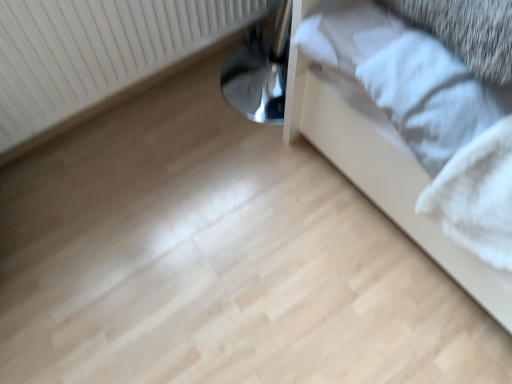
Measure the distance between white textured radiator at upper left and camera.

The depth of white textured radiator at upper left is 36.69 inches.

What do you see at coordinates (97, 55) in the screenshot?
I see `white textured radiator at upper left` at bounding box center [97, 55].

At what (x,y) coordinates should I click in order to perform the action: click on white textured radiator at upper left. Please return your answer as a coordinate pair (x, y). Looking at the image, I should click on (97, 55).

What do you see at coordinates (383, 176) in the screenshot?
I see `metallic bed frame at lower right` at bounding box center [383, 176].

What is the approximate width of metallic bed frame at lower right?

The width of metallic bed frame at lower right is 1.02 meters.

The image size is (512, 384). What are the coordinates of `metallic bed frame at lower right` in the screenshot? It's located at (383, 176).

This screenshot has width=512, height=384. I want to click on white textured radiator at upper left, so tap(97, 55).

Consider the image. Does white textured radiator at upper left appear on the left side of metallic bed frame at lower right?

Yes.

Which object is further away from the camera, white textured radiator at upper left or metallic bed frame at lower right?

white textured radiator at upper left is more distant.

Which is behind, point (150, 70) or point (303, 3)?

The point (150, 70) is farther.

From the image's perspective, is white textured radiator at upper left above metallic bed frame at lower right?

Yes.

From a real-world perspective, is white textured radiator at upper left over metallic bed frame at lower right?

No.

Is white textured radiator at upper left wider or thinner than metallic bed frame at lower right?

Considering their sizes, white textured radiator at upper left looks slimmer than metallic bed frame at lower right.

Considering the sizes of white textured radiator at upper left and metallic bed frame at lower right in the image, is white textured radiator at upper left taller or shorter than metallic bed frame at lower right?

Considering their sizes, white textured radiator at upper left has less height than metallic bed frame at lower right.

Does white textured radiator at upper left have a larger size compared to metallic bed frame at lower right?

No.

Is metallic bed frame at lower right a part of white textured radiator at upper left?

No, white textured radiator at upper left does not contain metallic bed frame at lower right.

Are white textured radiator at upper left and metallic bed frame at lower right located far from each other?

Actually, white textured radiator at upper left and metallic bed frame at lower right are a little close together.

Is metallic bed frame at lower right at the back of white textured radiator at upper left?

white textured radiator at upper left is not turned away from metallic bed frame at lower right.

What's the angular difference between white textured radiator at upper left and metallic bed frame at lower right's facing directions?

The angle between the facing direction of white textured radiator at upper left and the facing direction of metallic bed frame at lower right is 0.689 degrees.

At what (x,y) coordinates should I click in order to perform the action: click on furniture lying on the right of white textured radiator at upper left. Please return your answer as a coordinate pair (x, y). The height and width of the screenshot is (384, 512). Looking at the image, I should click on (383, 176).

Visually, is metallic bed frame at lower right positioned to the left or to the right of white textured radiator at upper left?

Based on their positions, metallic bed frame at lower right is located to the right of white textured radiator at upper left.

Is metallic bed frame at lower right closer to camera compared to white textured radiator at upper left?

Yes, it is in front of white textured radiator at upper left.

Which is closer, (416, 182) or (65, 86)?

The point (416, 182) is more forward.

From the image's perspective, is metallic bed frame at lower right positioned above or below white textured radiator at upper left?

Clearly, from the image's perspective, metallic bed frame at lower right is below white textured radiator at upper left.

From a real-world perspective, between metallic bed frame at lower right and white textured radiator at upper left, who is vertically lower?

white textured radiator at upper left.

Consider the image. Can you confirm if metallic bed frame at lower right is wider than white textured radiator at upper left?

Correct, the width of metallic bed frame at lower right exceeds that of white textured radiator at upper left.

Considering the relative sizes of metallic bed frame at lower right and white textured radiator at upper left in the image provided, is metallic bed frame at lower right taller than white textured radiator at upper left?

Yes.

Which of these two, metallic bed frame at lower right or white textured radiator at upper left, is smaller?

With smaller size is white textured radiator at upper left.

Is metallic bed frame at lower right located outside white textured radiator at upper left?

metallic bed frame at lower right lies outside white textured radiator at upper left's area.

Is metallic bed frame at lower right touching white textured radiator at upper left?

No, metallic bed frame at lower right is not making contact with white textured radiator at upper left.

Is white textured radiator at upper left at the back of metallic bed frame at lower right?

metallic bed frame at lower right is not turned away from white textured radiator at upper left.

Can you tell me how much metallic bed frame at lower right and white textured radiator at upper left differ in facing direction?

The angle between the facing direction of metallic bed frame at lower right and the facing direction of white textured radiator at upper left is 0.689 degrees.

Where is `radiator above the metallic bed frame at lower right (from the image's perspective)`? radiator above the metallic bed frame at lower right (from the image's perspective) is located at coordinates (97, 55).

You are a GUI agent. You are given a task and a screenshot of the screen. Output one action in this format:
    pyautogui.click(x=<x>, y=<y>)
    Task: Click on the radiator located behind the metallic bed frame at lower right
    This screenshot has width=512, height=384.
    Given the screenshot: What is the action you would take?
    pyautogui.click(x=97, y=55)

At what (x,y) coordinates should I click in order to perform the action: click on furniture above the white textured radiator at upper left (from a real-world perspective). Please return your answer as a coordinate pair (x, y). Image resolution: width=512 pixels, height=384 pixels. Looking at the image, I should click on point(383,176).